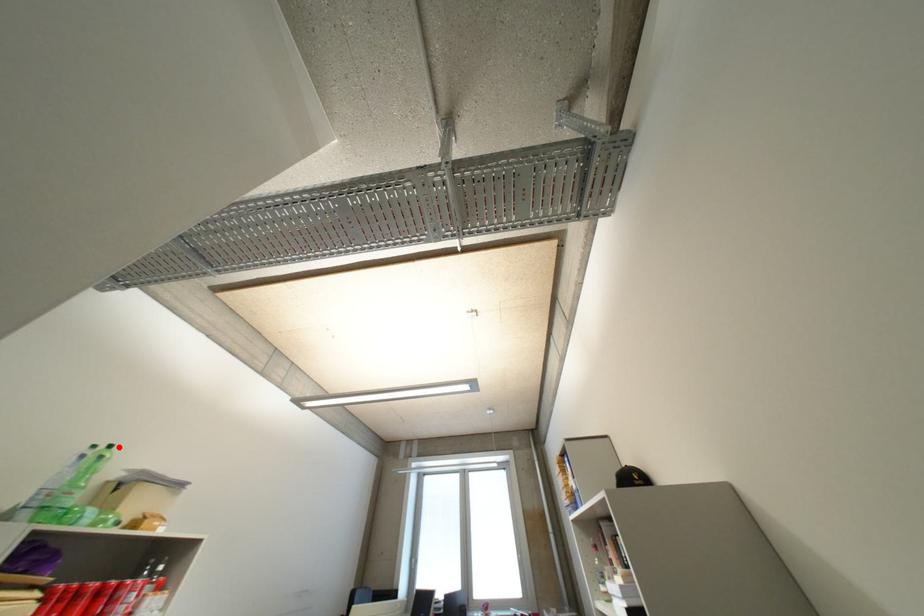
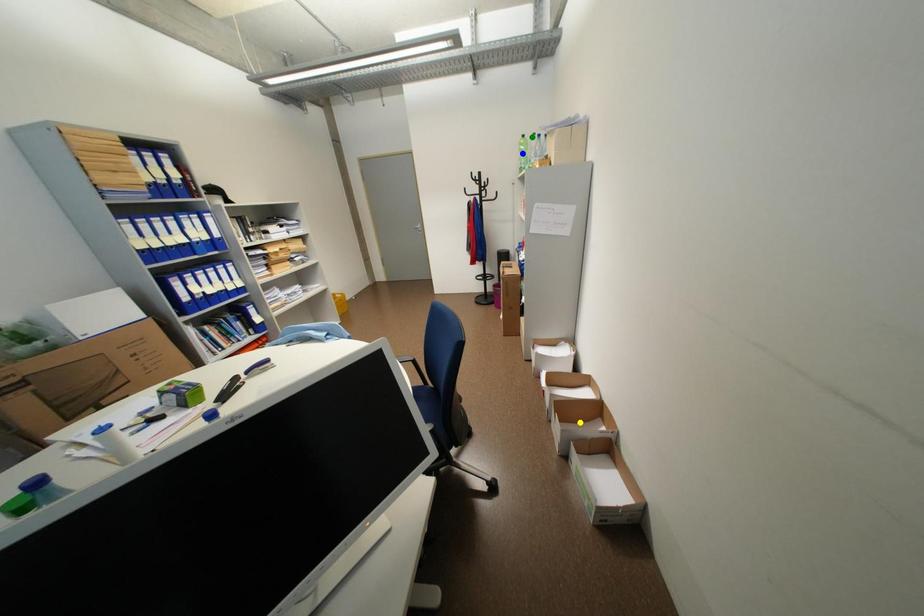
Question: I am providing you with two images of the same scene from different viewpoints. A red point is marked on the first image. You are given multiple points on the second image. Which point in image 2 is actually the same real-world point as the red point in image 1?

Choices:
 (A) yellow point
 (B) blue point
 (C) green point

Answer: (C)